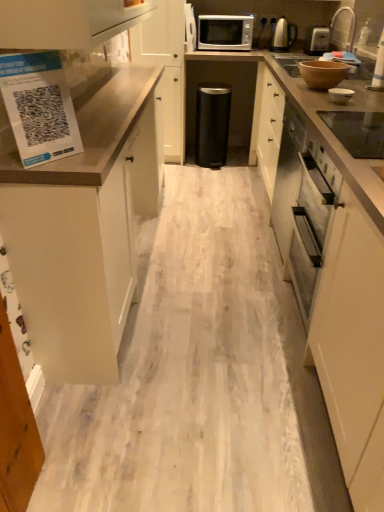
Describe the element at coordinates (85, 229) in the screenshot. I see `white matte cabinet at left, acting as the 1th cabinetry starting from the front` at that location.

The height and width of the screenshot is (512, 384). What do you see at coordinates (283, 35) in the screenshot? I see `satin silver kettle at upper right` at bounding box center [283, 35].

At what (x,y) coordinates should I click in order to perform the action: click on satin silver kettle at upper right. Please return your answer as a coordinate pair (x, y). Looking at the image, I should click on (283, 35).

Find the location of `satin silver toaster at upper right, which is the first appliance from right to left`. satin silver toaster at upper right, which is the first appliance from right to left is located at coordinates (318, 40).

This screenshot has height=512, width=384. Describe the element at coordinates (358, 132) in the screenshot. I see `black glass cooktop at upper right, arranged as the fifth appliance when viewed from the top` at that location.

Locate an element on the screen. brown matte countertop at right is located at coordinates (318, 124).

Find the location of `microwave oven behind the white matte cabinet at center, arranged as the first cabinetry when viewed from the back`. microwave oven behind the white matte cabinet at center, arranged as the first cabinetry when viewed from the back is located at coordinates (224, 32).

From the image's perspective, which one is positioned higher, satin silver microwave at upper center or white matte cabinet at center, arranged as the first cabinetry when viewed from the back?

From the image's view, satin silver microwave at upper center is above.

Is satin silver microwave at upper center aimed at white matte cabinet at center, arranged as the first cabinetry when viewed from the back?

No.

Considering the sizes of objects satin silver microwave at upper center and white matte cabinet at center, which ranks as the 2th cabinetry in front-to-back order, in the image provided, who is smaller, satin silver microwave at upper center or white matte cabinet at center, which ranks as the 2th cabinetry in front-to-back order,?

satin silver microwave at upper center is smaller.

Is black matte trash can at center, the 5th appliance from the front, not within satin silver toaster at upper right, marked as the second appliance in a back-to-front arrangement?

Yes.

Does black matte trash can at center, positioned as the fifth appliance in right-to-left order, touch satin silver toaster at upper right, the first appliance viewed from the top?

No, black matte trash can at center, positioned as the fifth appliance in right-to-left order, is not making contact with satin silver toaster at upper right, the first appliance viewed from the top.

From a real-world perspective, is black matte trash can at center, the 1th appliance when ordered from left to right, on satin silver toaster at upper right, the fifth appliance when ordered from left to right?

Actually, black matte trash can at center, the 1th appliance when ordered from left to right, is physically below satin silver toaster at upper right, the fifth appliance when ordered from left to right, in the real world.

Is satin silver kettle at upper right to the left of satin silver microwave at upper center from the viewer's perspective?

In fact, satin silver kettle at upper right is to the right of satin silver microwave at upper center.

Is satin silver kettle at upper right wider or thinner than satin silver microwave at upper center?

In the image, satin silver kettle at upper right appears to be more narrow than satin silver microwave at upper center.

Based on the photo, considering the sizes of objects satin silver kettle at upper right and satin silver microwave at upper center in the image provided, who is shorter, satin silver kettle at upper right or satin silver microwave at upper center?

Standing shorter between the two is satin silver microwave at upper center.

From the image's perspective, is satin silver microwave at upper center below satin silver kettle at upper right?

No, from the image's perspective, satin silver microwave at upper center is not below satin silver kettle at upper right.

How many degrees apart are the facing directions of satin silver microwave at upper center and satin silver kettle at upper right?

satin silver microwave at upper center and satin silver kettle at upper right are facing 1.22 degrees away from each other.

Are satin silver microwave at upper center and satin silver kettle at upper right making contact?

satin silver microwave at upper center and satin silver kettle at upper right are clearly separated.

Is satin silver microwave at upper center looking in the opposite direction of satin silver kettle at upper right?

No, satin silver microwave at upper center's orientation is not away from satin silver kettle at upper right.

Can you confirm if brown matte countertop at right is thinner than satin silver kettle at upper right?

No.

From the image's perspective, between brown matte countertop at right and satin silver kettle at upper right, which one is located above?

satin silver kettle at upper right is shown above in the image.

In the image, is brown matte countertop at right positioned in front of or behind satin silver kettle at upper right?

In the image, brown matte countertop at right appears in front of satin silver kettle at upper right.

Can you tell me how much brown matte countertop at right and satin silver kettle at upper right differ in facing direction?

They differ by 90.3 degrees in their facing directions.

How much distance is there between white matte cabinet at center, which ranks as the 2th cabinetry in front-to-back order, and brown matte countertop at right?

They are 1.39 meters apart.

Considering the relative sizes of white matte cabinet at center, which ranks as the 2th cabinetry in front-to-back order, and brown matte countertop at right in the image provided, is white matte cabinet at center, which ranks as the 2th cabinetry in front-to-back order, wider than brown matte countertop at right?

→ No, white matte cabinet at center, which ranks as the 2th cabinetry in front-to-back order, is not wider than brown matte countertop at right.

From a real-world perspective, relative to brown matte countertop at right, is white matte cabinet at center, which ranks as the 2th cabinetry in front-to-back order, vertically above or below?

Clearly, from a real-world perspective, white matte cabinet at center, which ranks as the 2th cabinetry in front-to-back order, is above brown matte countertop at right.

Are white matte cabinet at center, arranged as the first cabinetry when viewed from the back, and brown matte countertop at right beside each other?

white matte cabinet at center, arranged as the first cabinetry when viewed from the back, and brown matte countertop at right are clearly separated.

Considering the sizes of objects satin silver microwave at upper center and brown matte countertop at right in the image provided, who is wider, satin silver microwave at upper center or brown matte countertop at right?

With larger width is brown matte countertop at right.

From a real-world perspective, is satin silver microwave at upper center below brown matte countertop at right?

No, from a real-world perspective, satin silver microwave at upper center is not beneath brown matte countertop at right.

Is satin silver microwave at upper center facing towards brown matte countertop at right?

No, satin silver microwave at upper center is not oriented towards brown matte countertop at right.

Where is `microwave oven located on the right of white matte cabinet at center, arranged as the first cabinetry when viewed from the back`? Image resolution: width=384 pixels, height=512 pixels. microwave oven located on the right of white matte cabinet at center, arranged as the first cabinetry when viewed from the back is located at coordinates (224, 32).

There is a satin silver toaster at upper right, marked as the second appliance in a back-to-front arrangement. At what (x,y) coordinates should I click in order to perform the action: click on the 4th appliance below it (from a real-world perspective). Please return your answer as a coordinate pair (x, y). This screenshot has height=512, width=384. Looking at the image, I should click on (212, 124).

Which object lies further to the anchor point brown matte countertop at right, white matte cabinet at center, arranged as the first cabinetry when viewed from the back, or black matte trash can at center, positioned as the fifth appliance in right-to-left order?

black matte trash can at center, positioned as the fifth appliance in right-to-left order.

When comparing their distances from white glossy bowl at upper right, the second appliance from the front, does black matte trash can at center, which is the second appliance in top-to-bottom order, or brown matte bowl at upper right, arranged as the 3th appliance when viewed from the left, seem further?

black matte trash can at center, which is the second appliance in top-to-bottom order, is positioned further to the anchor white glossy bowl at upper right, the second appliance from the front.

Considering their positions, is white matte cabinet at left, acting as the 1th cabinetry starting from the front, positioned closer to satin silver toaster at upper right, the first appliance viewed from the top, than satin silver microwave at upper center?

satin silver microwave at upper center lies closer to satin silver toaster at upper right, the first appliance viewed from the top, than the other object.

From the image, which object appears to be nearer to brown matte countertop at right, black matte trash can at center, which is the second appliance in top-to-bottom order, or satin silver kettle at upper right?

black matte trash can at center, which is the second appliance in top-to-bottom order, is closer to brown matte countertop at right.

Looking at the image, which one is located closer to satin silver microwave at upper center, brown matte countertop at right or brown matte bowl at upper right, placed as the 3th appliance when sorted from right to left?

Based on the image, brown matte countertop at right appears to be nearer to satin silver microwave at upper center.

Based on the photo, from the image, which object appears to be farther from satin silver toaster at upper right, which is the first appliance from right to left, white matte cabinet at left, acting as the 1th cabinetry starting from the front, or brown matte bowl at upper right, marked as the 3th appliance in a front-to-back arrangement?

The object further to satin silver toaster at upper right, which is the first appliance from right to left, is white matte cabinet at left, acting as the 1th cabinetry starting from the front.

Which object lies nearer to the anchor point brown matte countertop at right, brown matte bowl at upper right, the 3th appliance ordered from the bottom, or white matte cabinet at center, which ranks as the 2th cabinetry in front-to-back order?

brown matte bowl at upper right, the 3th appliance ordered from the bottom.

Which object lies nearer to the anchor point black matte trash can at center, the 1th appliance when ordered from left to right, white matte cabinet at left, acting as the 1th cabinetry starting from the front, or white matte cabinet at center, which ranks as the 2th cabinetry in front-to-back order?

white matte cabinet at center, which ranks as the 2th cabinetry in front-to-back order, is closer to black matte trash can at center, the 1th appliance when ordered from left to right.

You are a GUI agent. You are given a task and a screenshot of the screen. Output one action in this format:
    pyautogui.click(x=<x>, y=<y>)
    Task: Click on the microwave oven positioned between brown matte bowl at upper right, marked as the 3th appliance in a top-to-bottom arrangement, and black matte trash can at center, the 5th appliance from the front, from near to far
    
    Given the screenshot: What is the action you would take?
    pyautogui.click(x=224, y=32)

The image size is (384, 512). Identify the location of microwave oven positioned between white matte cabinet at left, acting as the 1th cabinetry starting from the front, and black matte trash can at center, which is the second appliance in top-to-bottom order, from near to far. (224, 32).

Where is `microwave oven between white matte cabinet at left, the 2th cabinetry when ordered from back to front, and satin silver kettle at upper right, along the z-axis`? The width and height of the screenshot is (384, 512). microwave oven between white matte cabinet at left, the 2th cabinetry when ordered from back to front, and satin silver kettle at upper right, along the z-axis is located at coordinates (224, 32).

I want to click on cabinetry between white glossy bowl at upper right, the fourth appliance in the back-to-front sequence, and satin silver kettle at upper right from front to back, so click(166, 67).